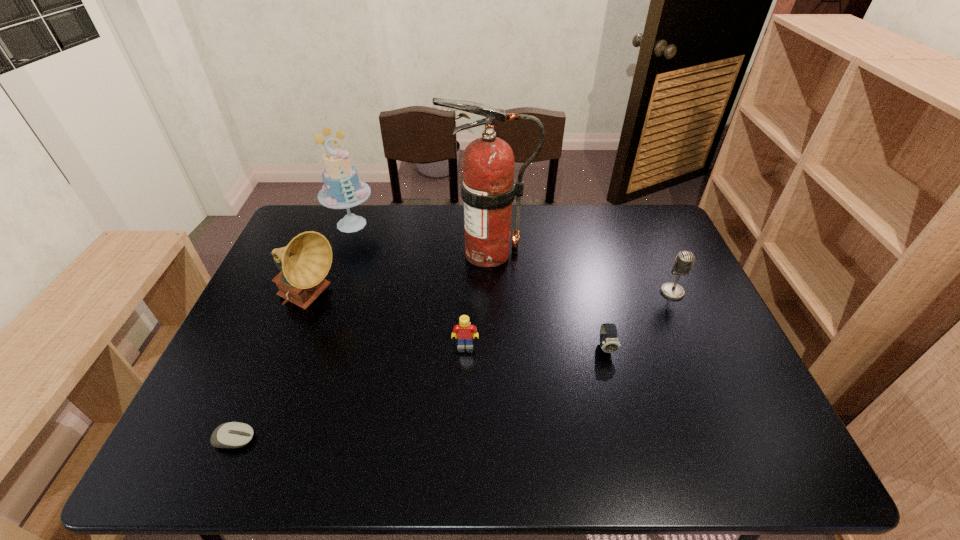
Identify the location of cake that is positioned at the far edge. (342, 188).

Locate an element on the screen. The image size is (960, 540). object present at the near edge is located at coordinates (232, 434).

Locate an element on the screen. cake that is at the left edge is located at coordinates (342, 188).

Locate an element on the screen. phonograph record at the left edge is located at coordinates (306, 260).

Find the location of `computer equipment present at the left edge`. computer equipment present at the left edge is located at coordinates (232, 434).

Identify the location of object present at the right edge. Image resolution: width=960 pixels, height=540 pixels. (684, 260).

Find the location of `object that is positioned at the far left corner`. object that is positioned at the far left corner is located at coordinates (342, 188).

This screenshot has width=960, height=540. In order to click on object situated at the near left corner in this screenshot , I will do `click(232, 434)`.

Locate an element on the screen. vacant region at the far edge of the desktop is located at coordinates (515, 221).

The image size is (960, 540). I want to click on free location at the near edge, so click(284, 457).